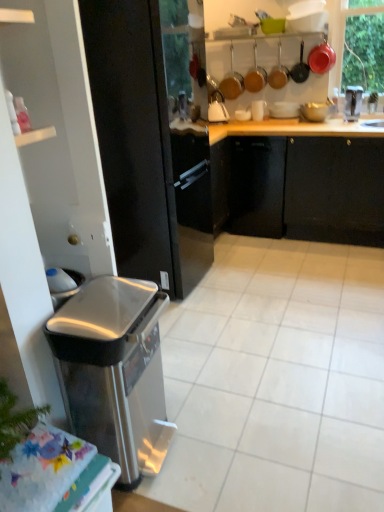
The image size is (384, 512). In order to click on free spot above printed fabric table at lower left (from a real-world perspective) in this screenshot , I will do `click(37, 464)`.